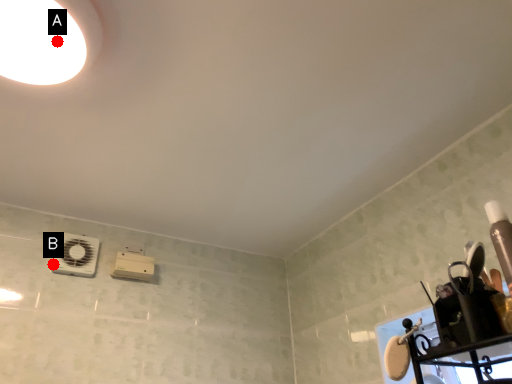
Question: Two points are circled on the image, labeled by A and B beside each circle. Which point is closer to the camera?

Choices:
 (A) A is closer
 (B) B is closer

Answer: (A)